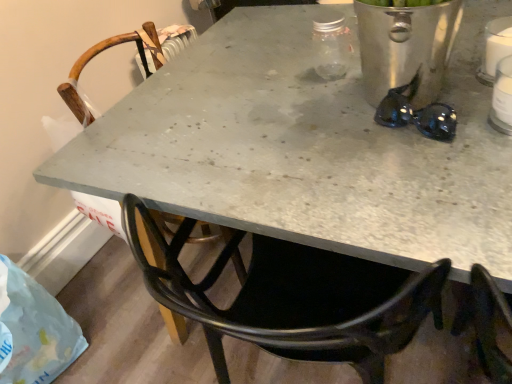
Question: Does black shiny sunglasses at upper right have a smaller size compared to wooden chair at center?

Choices:
 (A) yes
 (B) no

Answer: (A)

Question: Is wooden chair at center a part of black shiny sunglasses at upper right?

Choices:
 (A) no
 (B) yes

Answer: (A)

Question: From a real-world perspective, is black shiny sunglasses at upper right on wooden chair at center?

Choices:
 (A) no
 (B) yes

Answer: (B)

Question: From the image's perspective, is black shiny sunglasses at upper right over wooden chair at center?

Choices:
 (A) no
 (B) yes

Answer: (A)

Question: From a real-world perspective, is black shiny sunglasses at upper right below wooden chair at center?

Choices:
 (A) no
 (B) yes

Answer: (A)

Question: From the image's perspective, is black shiny sunglasses at upper right located above or below translucent plastic bag at lower left?

Choices:
 (A) above
 (B) below

Answer: (A)

Question: Visually, is black shiny sunglasses at upper right positioned to the left or to the right of translucent plastic bag at lower left?

Choices:
 (A) right
 (B) left

Answer: (A)

Question: Considering the positions of point (407, 114) and point (19, 375), is point (407, 114) closer or farther from the camera than point (19, 375)?

Choices:
 (A) closer
 (B) farther

Answer: (A)

Question: Considering their positions, is black shiny sunglasses at upper right located in front of or behind translucent plastic bag at lower left?

Choices:
 (A) front
 (B) behind

Answer: (A)

Question: From the image's perspective, is white plastic bottle at upper right located above or below black shiny sunglasses at upper right?

Choices:
 (A) above
 (B) below

Answer: (A)

Question: Based on their sizes in the image, would you say white plastic bottle at upper right is bigger or smaller than black shiny sunglasses at upper right?

Choices:
 (A) big
 (B) small

Answer: (A)

Question: From a real-world perspective, relative to black shiny sunglasses at upper right, is white plastic bottle at upper right vertically above or below?

Choices:
 (A) above
 (B) below

Answer: (A)

Question: Considering the positions of white plastic bottle at upper right and black shiny sunglasses at upper right in the image, is white plastic bottle at upper right wider or thinner than black shiny sunglasses at upper right?

Choices:
 (A) thin
 (B) wide

Answer: (B)

Question: Considering the relative positions of translucent plastic bag at lower left and black shiny sunglasses at upper right in the image provided, is translucent plastic bag at lower left to the left or to the right of black shiny sunglasses at upper right?

Choices:
 (A) left
 (B) right

Answer: (A)

Question: Relative to black shiny sunglasses at upper right, is translucent plastic bag at lower left in front or behind?

Choices:
 (A) front
 (B) behind

Answer: (B)